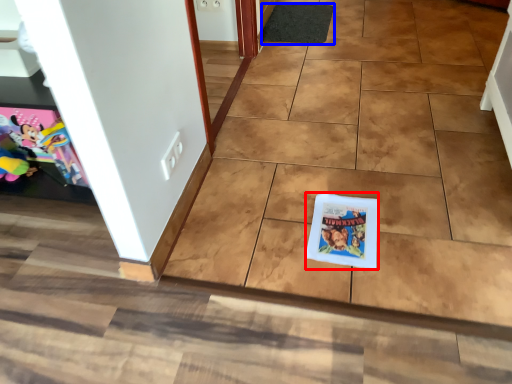
Question: Which object appears farthest to the camera in this image, comic book (highlighted by a red box) or doormat (highlighted by a blue box)?

Choices:
 (A) comic book
 (B) doormat

Answer: (B)